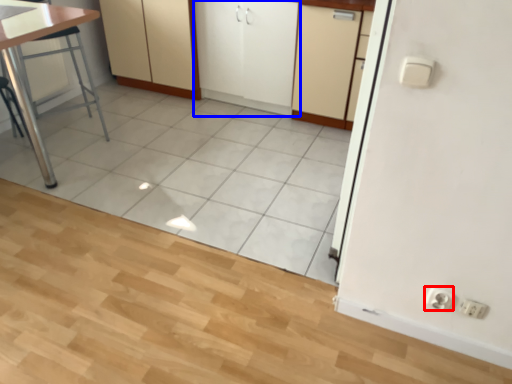
Question: Which point is further to the camera, electric outlet (highlighted by a red box) or cabinetry (highlighted by a blue box)?

Choices:
 (A) electric outlet
 (B) cabinetry

Answer: (B)